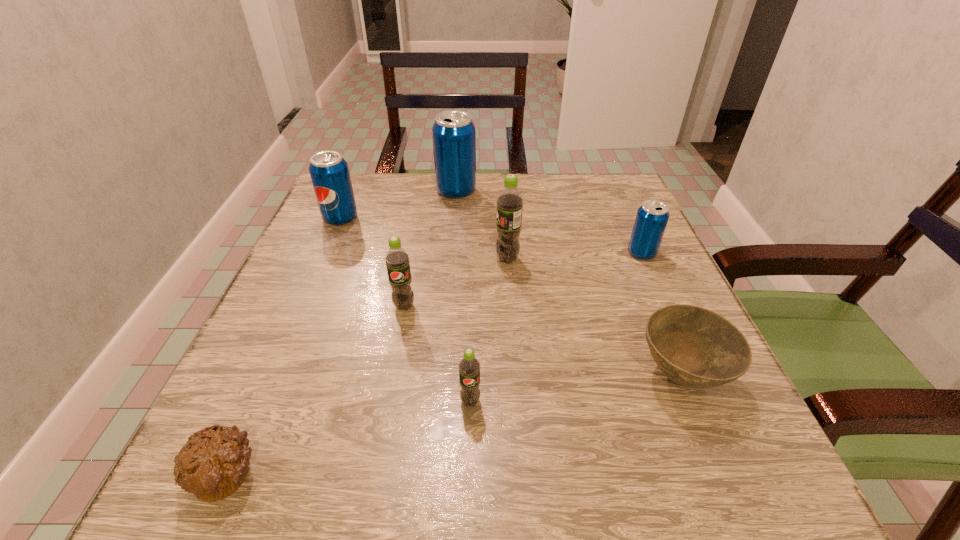
I want to click on the closest soda relative to the biggest green soda, so click(x=397, y=259).

I want to click on soda that can be found as the closest to the shortest object, so click(x=469, y=366).

Locate which blue pop soda ranks in proximity to the farthest blue pop soda. Please provide its 2D coordinates. Your answer should be formatted as a tuple, i.e. [(x, y)], where the tuple contains the x and y coordinates of a point satisfying the conditions above.

[(329, 172)]

I want to click on blue pop soda that is the second closest to the muffin, so click(454, 134).

Choose which green soda is the third nearest neighbor to the shortest object. Please provide its 2D coordinates. Your answer should be formatted as a tuple, i.e. [(x, y)], where the tuple contains the x and y coordinates of a point satisfying the conditions above.

[(510, 202)]

Identify which green soda is located as the third nearest to the nearest object. Please provide its 2D coordinates. Your answer should be formatted as a tuple, i.e. [(x, y)], where the tuple contains the x and y coordinates of a point satisfying the conditions above.

[(510, 202)]

The height and width of the screenshot is (540, 960). In order to click on vacant space that satisfies the following two spatial constraints: 1. on the front label of the rightmost green soda; 2. on the left side of the second shortest object in this screenshot , I will do `click(516, 375)`.

This screenshot has width=960, height=540. I want to click on blank area in the image that satisfies the following two spatial constraints: 1. on the front label of the third object from right to left; 2. on the left side of the bowl, so click(516, 375).